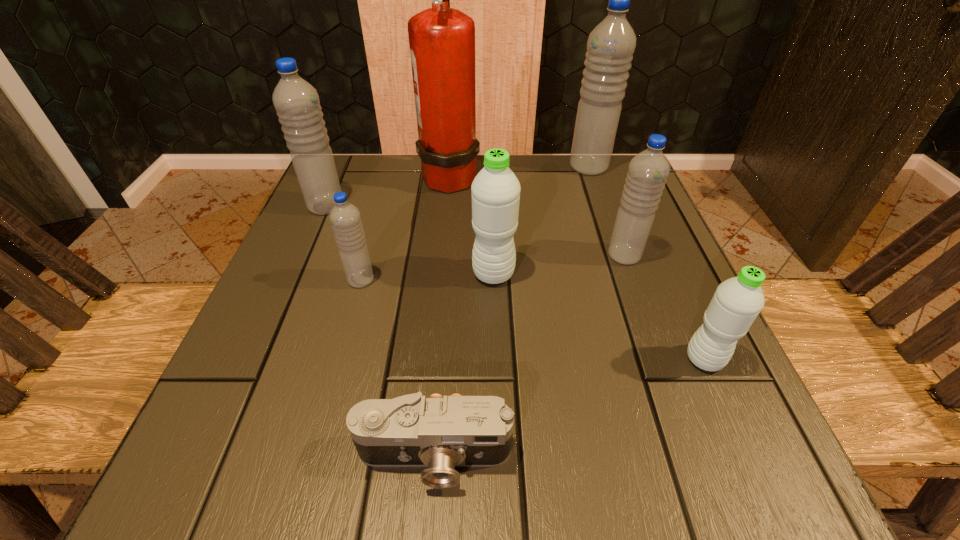
Identify the location of vacant space located on the back of the seventh object from right to left. (376, 224).

Where is `free space located 0.100m on the left of the right green water bottle`? The width and height of the screenshot is (960, 540). free space located 0.100m on the left of the right green water bottle is located at coordinates pyautogui.click(x=619, y=359).

Locate an element on the screen. The image size is (960, 540). fire extinguisher situated at the far edge is located at coordinates (x=442, y=40).

The image size is (960, 540). What are the coordinates of `object that is positioned at the near edge` in the screenshot? It's located at (441, 433).

Identify the location of object positioned at the far left corner. Image resolution: width=960 pixels, height=540 pixels. (296, 101).

Locate an element on the screen. The height and width of the screenshot is (540, 960). object positioned at the far right corner is located at coordinates (610, 47).

Identify the location of vacant space at the far edge of the desktop. Image resolution: width=960 pixels, height=540 pixels. (540, 156).

In order to click on blank area at the near edge in this screenshot , I will do `click(594, 459)`.

Image resolution: width=960 pixels, height=540 pixels. Identify the location of blank area at the left edge. (322, 386).

At what (x,y) coordinates should I click in order to perform the action: click on vacant region at the right edge of the desktop. Please return your answer as a coordinate pair (x, y). Image resolution: width=960 pixels, height=540 pixels. Looking at the image, I should click on coord(706,385).